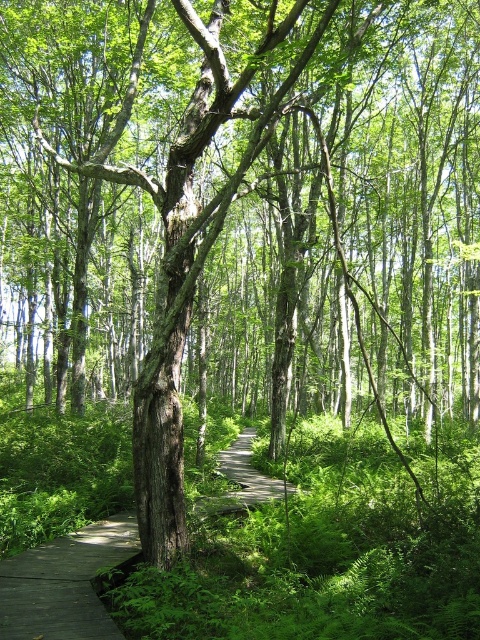
Question: Can you confirm if wooden at center is bigger than wooden boardwalk at center?

Choices:
 (A) yes
 (B) no

Answer: (B)

Question: Among these points, which one is farthest from the camera?

Choices:
 (A) (245, 433)
 (B) (103, 563)

Answer: (A)

Question: Can you confirm if wooden at center is wider than wooden boardwalk at center?

Choices:
 (A) yes
 (B) no

Answer: (A)

Question: Which object is farther from the camera taking this photo?

Choices:
 (A) wooden at center
 (B) wooden boardwalk at center

Answer: (B)

Question: Can you confirm if wooden at center is bigger than wooden boardwalk at center?

Choices:
 (A) no
 (B) yes

Answer: (A)